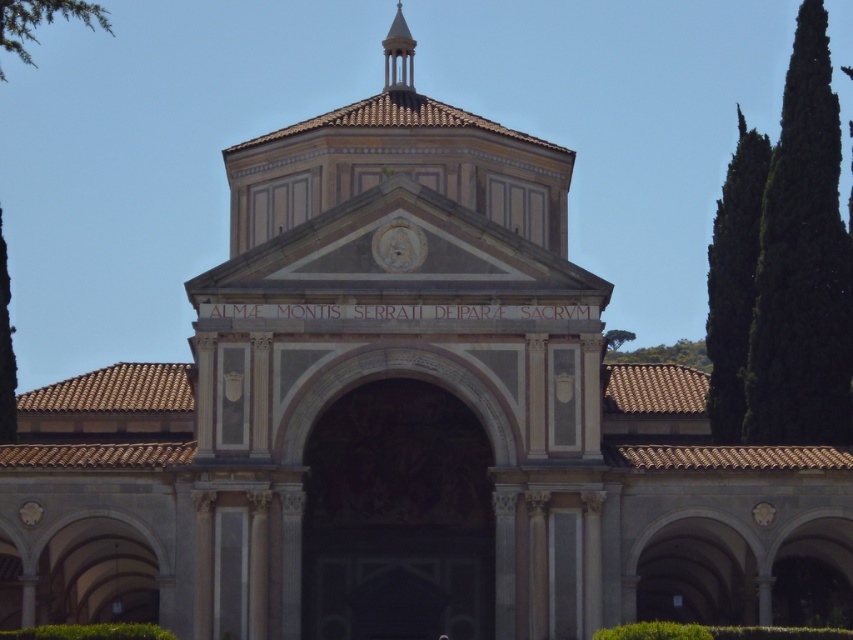
Question: Estimate the real-world distances between objects in this image. Which object is farther from the dark green leafy tree at right?

Choices:
 (A) green leafy tree at left
 (B) green leafy tree at right

Answer: (A)

Question: Can you confirm if green leafy tree at right is bigger than green leafy tree at left?

Choices:
 (A) no
 (B) yes

Answer: (A)

Question: Can you confirm if dark green leafy tree at right is positioned to the right of green leafy tree at upper right?

Choices:
 (A) no
 (B) yes

Answer: (B)

Question: Can you confirm if green leafy tree at left is bigger than green leafy tree at upper right?

Choices:
 (A) yes
 (B) no

Answer: (A)

Question: Which of these objects is positioned closest to the dark green leafy tree at right?

Choices:
 (A) green leafy tree at right
 (B) green leafy tree at upper right
 (C) green leafy tree at left

Answer: (A)

Question: Which of the following is the closest to the observer?

Choices:
 (A) (672, 355)
 (B) (749, 173)
 (C) (769, 209)
 (D) (0, 256)

Answer: (C)